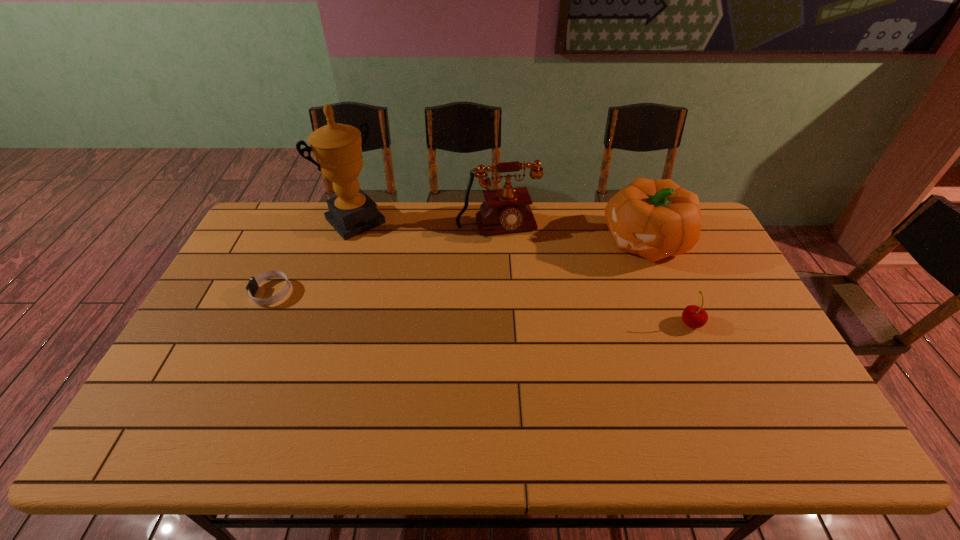
Where is `free area in between the third object from right to left and the fourth object from right to left`? This screenshot has width=960, height=540. free area in between the third object from right to left and the fourth object from right to left is located at coordinates (426, 224).

Find the location of a particular element. The width and height of the screenshot is (960, 540). vacant space that's between the wristband and the fourth tallest object is located at coordinates (482, 308).

This screenshot has height=540, width=960. In order to click on vacant space that is in between the pumpkin and the fourth farthest object in this screenshot , I will do `click(460, 267)`.

Locate an element on the screen. This screenshot has height=540, width=960. free point between the third object from left to right and the fourth object from right to left is located at coordinates (426, 224).

What are the coordinates of `vacant space that's between the leftmost object and the cherry` in the screenshot? It's located at 482,308.

This screenshot has width=960, height=540. Find the location of `object that is the closest one to the third object from left to right`. object that is the closest one to the third object from left to right is located at coordinates (655, 219).

Select which object appears as the closest to the third object from left to right. Please provide its 2D coordinates. Your answer should be formatted as a tuple, i.e. [(x, y)], where the tuple contains the x and y coordinates of a point satisfying the conditions above.

[(655, 219)]